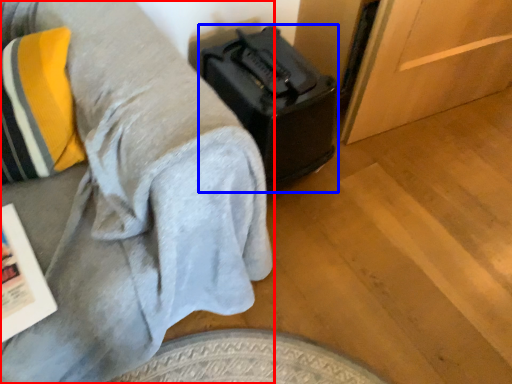
Question: Which object appears farthest to the camera in this image, furniture (highlighted by a red box) or luggage (highlighted by a blue box)?

Choices:
 (A) furniture
 (B) luggage

Answer: (B)